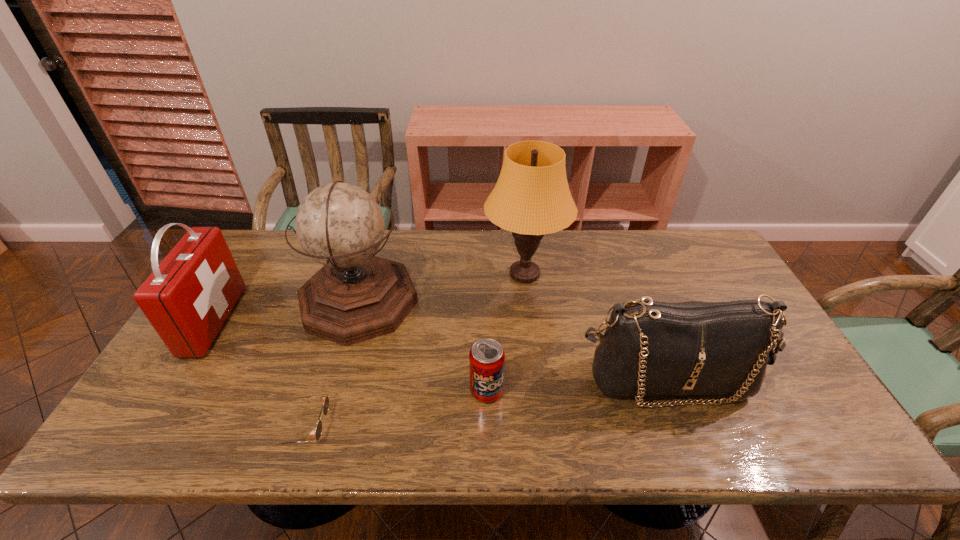
Find the location of `unoccupied position between the globe and the leftmost object`. unoccupied position between the globe and the leftmost object is located at coordinates (286, 311).

Where is `object that is the fifth closest to the first-aid kit`? object that is the fifth closest to the first-aid kit is located at coordinates (649, 348).

The image size is (960, 540). What are the coordinates of `object that stands as the closest to the handbag` in the screenshot? It's located at pos(531,198).

Where is `free space that satisfies the following two spatial constraints: 1. on the back side of the soda can; 2. on the left side of the lampshade`? free space that satisfies the following two spatial constraints: 1. on the back side of the soda can; 2. on the left side of the lampshade is located at coordinates (485, 274).

The width and height of the screenshot is (960, 540). What are the coordinates of `vacant point that satisfies the following two spatial constraints: 1. on the surface of the globe; 2. on the back side of the soda can` in the screenshot? It's located at (333, 391).

The width and height of the screenshot is (960, 540). I want to click on free space that satisfies the following two spatial constraints: 1. on the front face of the fifth tallest object; 2. on the right side of the first-aid kit, so click(x=170, y=391).